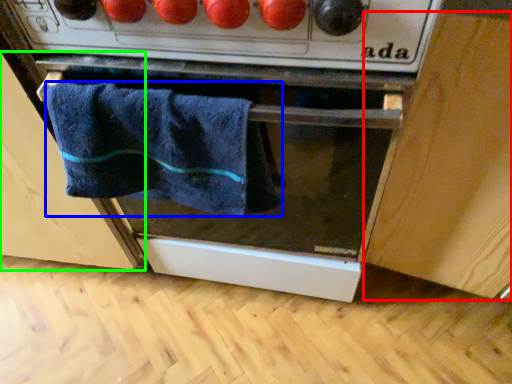
Question: Considering the real-world distances, which object is farthest from cabinetry (highlighted by a red box)? towel (highlighted by a blue box) or cabinetry (highlighted by a green box)?

Choices:
 (A) towel
 (B) cabinetry

Answer: (B)